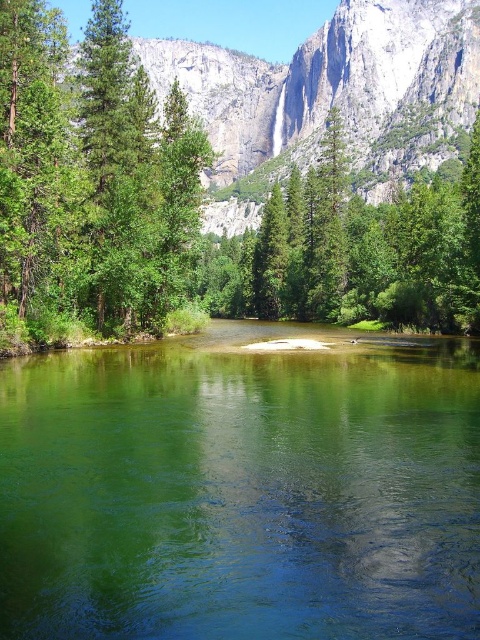
Is green leafy tree at center further to camera compared to green matte tree at center?

No, green leafy tree at center is closer to the viewer.

Which is in front, point (340, 268) or point (288, 189)?

Point (340, 268) is more forward.

Identify the location of green leafy tree at center. (239, 172).

Does clear glass lake at center appear on the left side of green matte tree at left?

In fact, clear glass lake at center is to the right of green matte tree at left.

Who is shorter, clear glass lake at center or green matte tree at left?

clear glass lake at center

In order to click on clear glass lake at center in this screenshot , I will do `click(241, 488)`.

I want to click on clear glass lake at center, so click(241, 488).

At what (x,y) coordinates should I click in order to perform the action: click on green matte tree at left. Please return your answer as a coordinate pair (x, y). This screenshot has height=640, width=480. Looking at the image, I should click on (92, 179).

Image resolution: width=480 pixels, height=640 pixels. Identify the location of green matte tree at left. (92, 179).